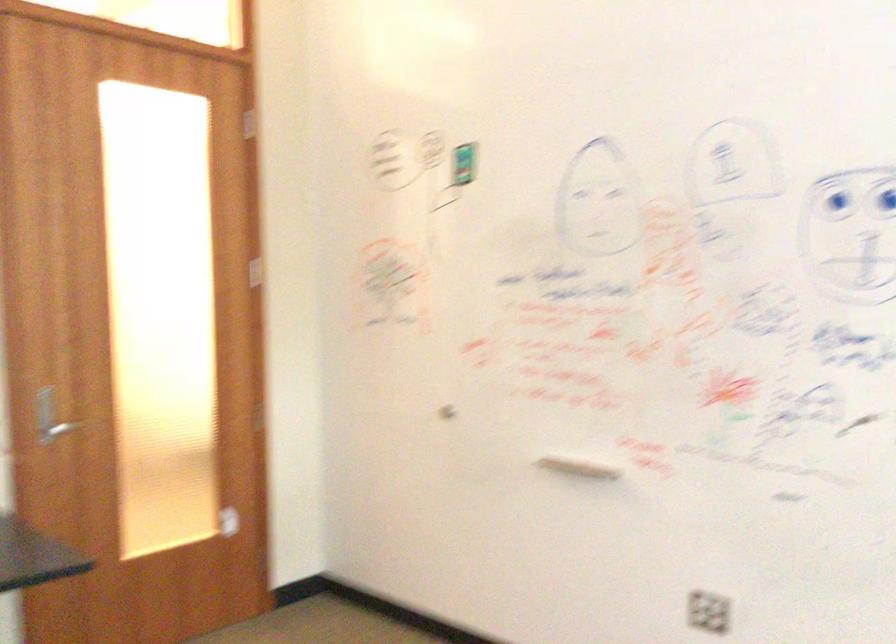
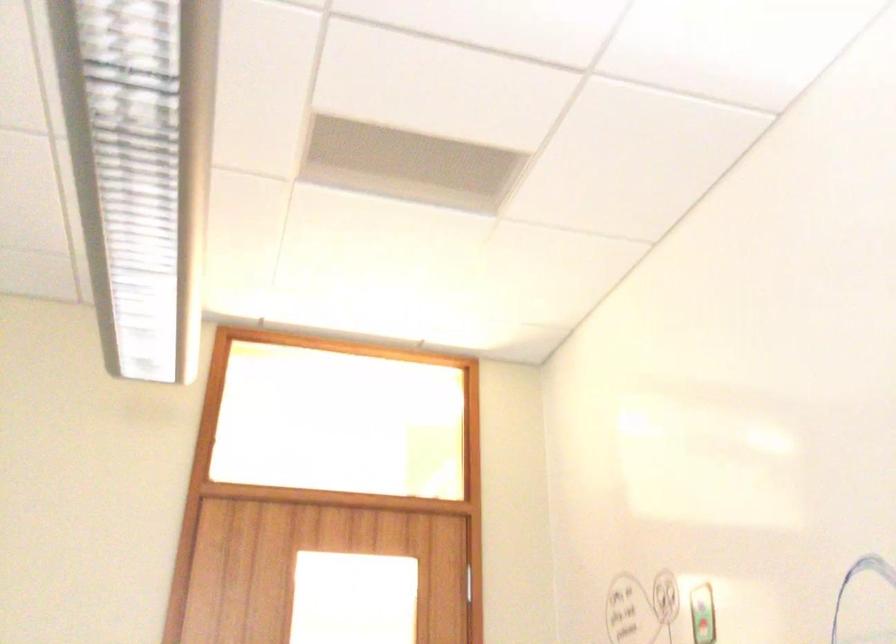
How did the camera likely rotate?

The camera's rotation is toward left-up.